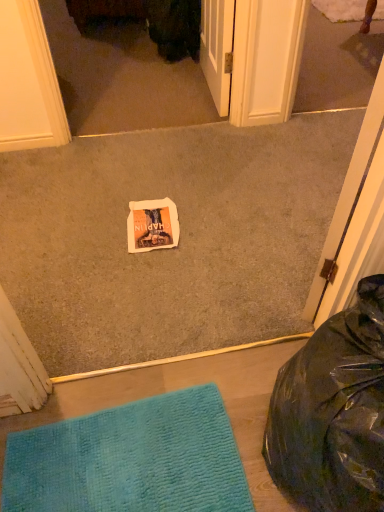
This screenshot has height=512, width=384. I want to click on vacant region above teal textured mat at lower left (from a real-world perspective), so click(x=129, y=454).